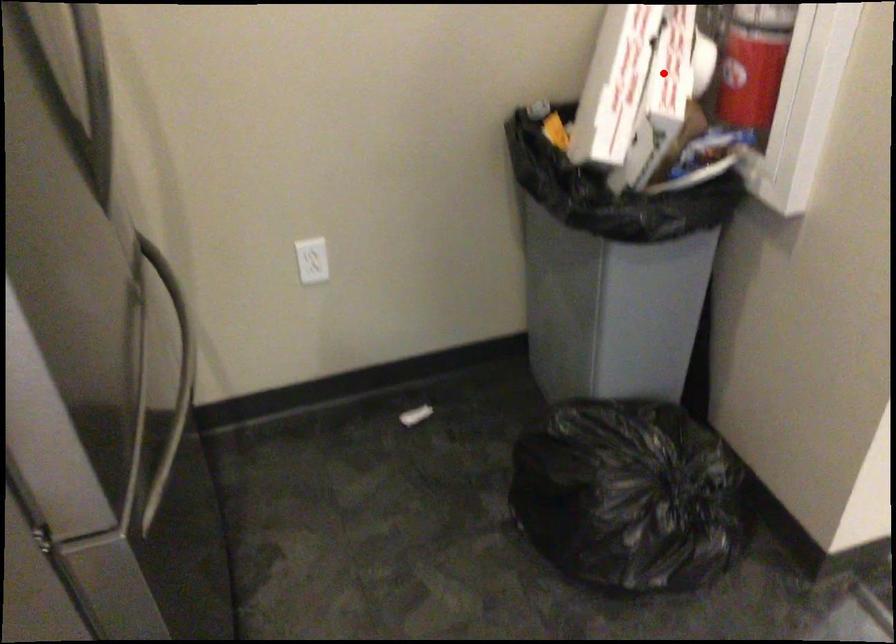
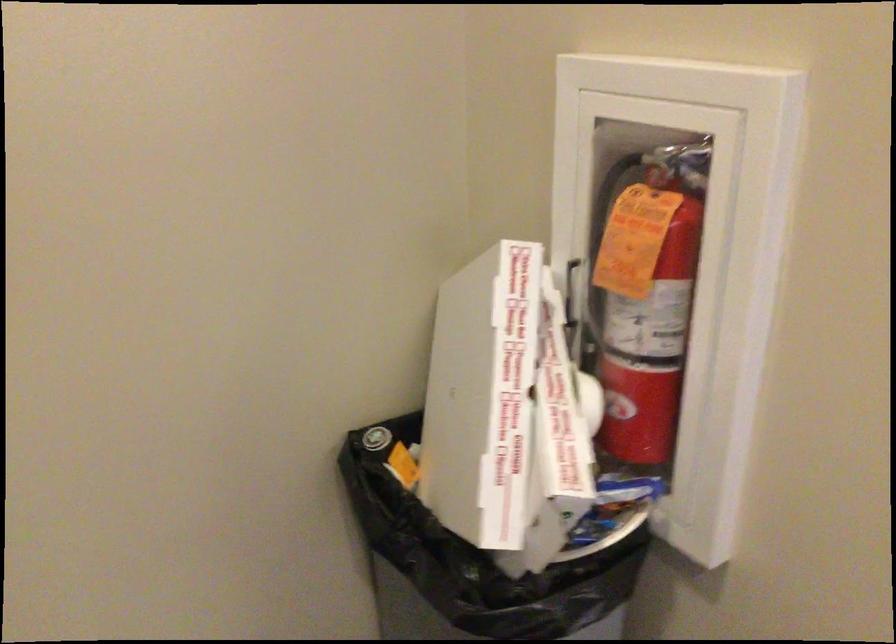
Question: A red point is marked in image1. In image2, is the corresponding 3D point closer to the camera or farther? Reply with the corresponding letter.

Choices:
 (A) The corresponding 3D point is closer.
 (B) The corresponding 3D point is farther.

Answer: (A)